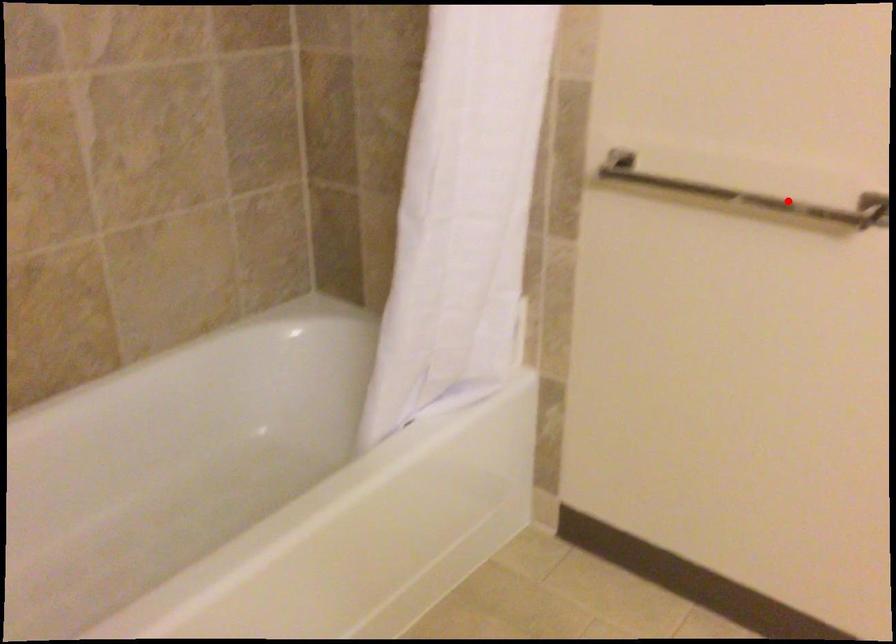
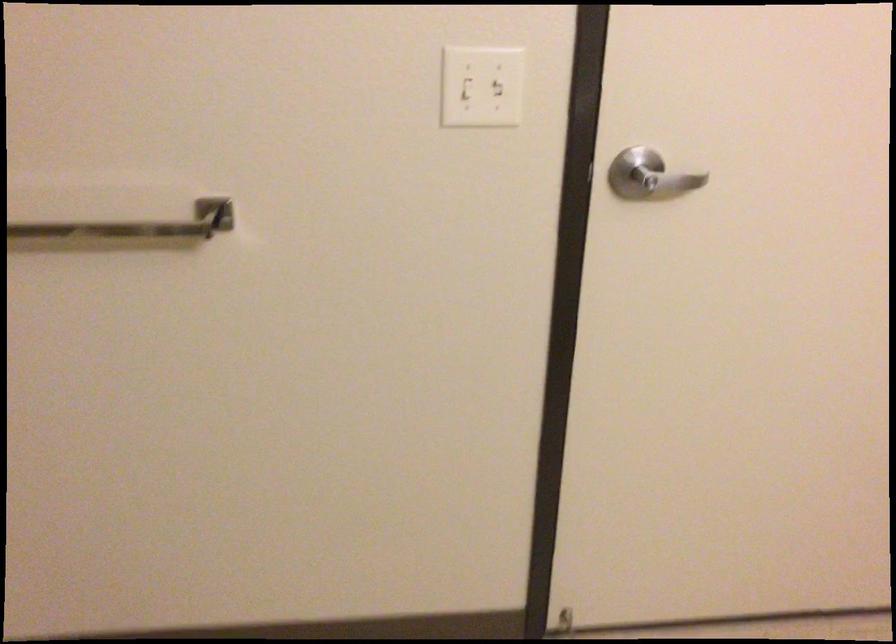
Question: I am providing you with two images of the same scene from different viewpoints. Given a red point in image1, look at the same physical point in image2. Is it:

Choices:
 (A) Closer to the viewpoint
 (B) Farther from the viewpoint

Answer: (A)